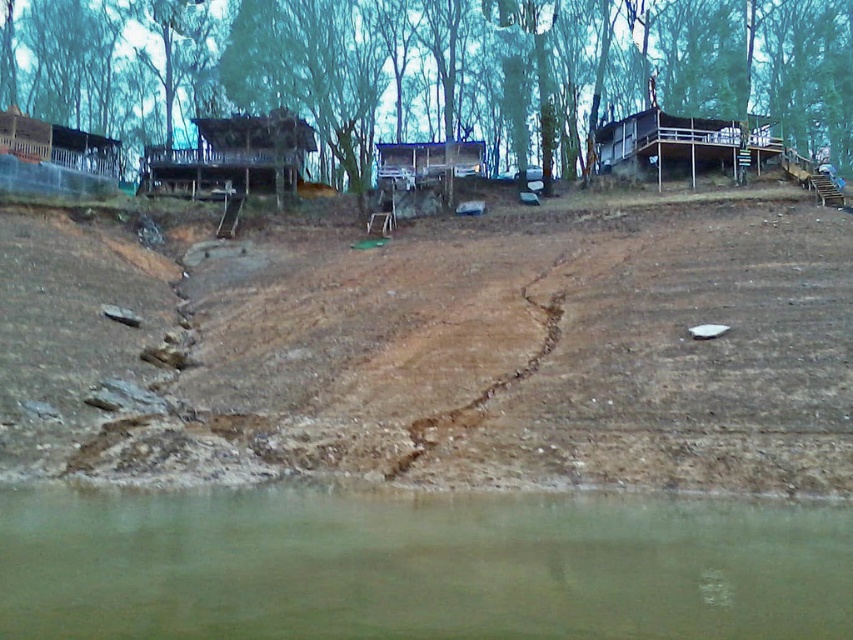
From the picture: You are standing at the edge of the brown sandy dirt field at lower left and want to reach the wooden cabin at left. Which direction should you move to get there?

The brown sandy dirt field at lower left is located below the wooden cabin at left, so you should move upward to reach the wooden cabin at left from the brown sandy dirt field at lower left.

You are standing at the edge of the water and want to reach the wooden cabin at upper right. Which direction should you move to get closer to it without entering the brown muddy water at lower center?

You should move away from the brown muddy water at lower center since it is closer to you than the wooden cabin at upper right. To reach the cabin, head towards the upper right direction while staying on the shoreline away from the water.

You are standing at the shoreline looking towards the wooden structures. Which of the two points, point (822,580) or point (715,120), is closer to you?

Point (822,580) is closer to you than point (715,120).